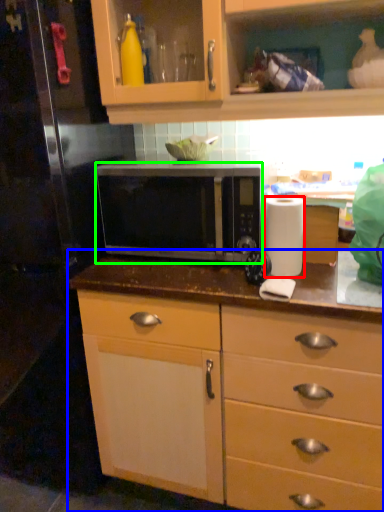
Question: Which is farther away from paper towel (highlighted by a red box)? countertop (highlighted by a blue box) or microwave oven (highlighted by a green box)?

Choices:
 (A) countertop
 (B) microwave oven

Answer: (A)